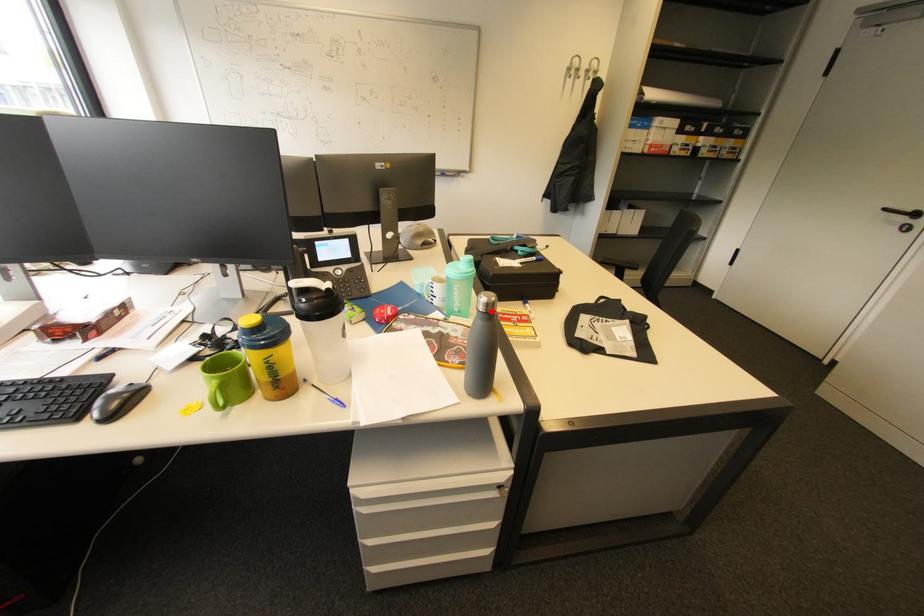
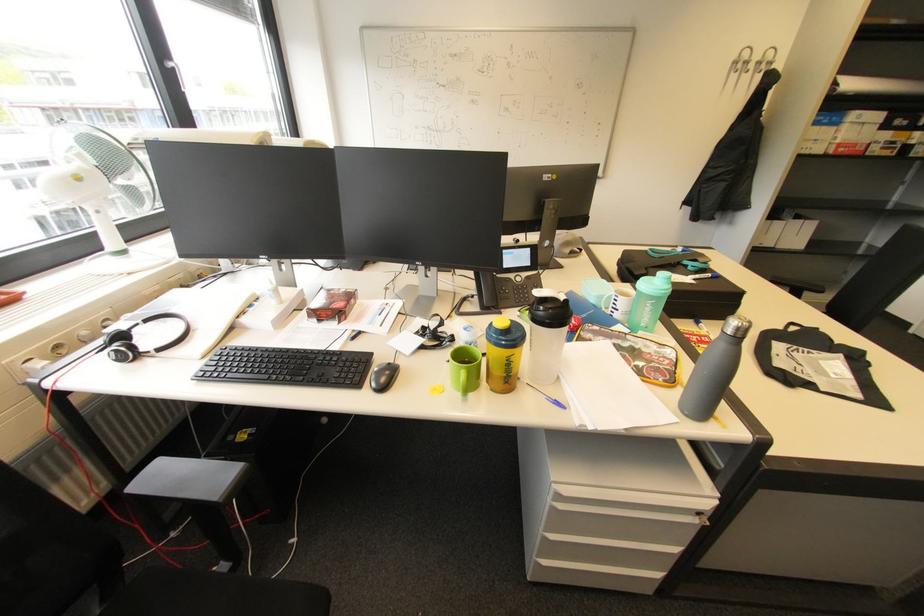
Locate, in the second image, the point that corresponds to the highlighted location in the first image.

(739, 334)